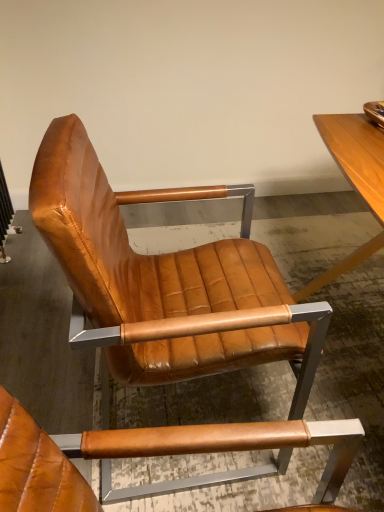
What do you see at coordinates (165, 281) in the screenshot? This screenshot has height=512, width=384. I see `cognac leather chair at center` at bounding box center [165, 281].

Find the location of a particular element. cognac leather chair at center is located at coordinates (165, 281).

Image resolution: width=384 pixels, height=512 pixels. I want to click on cognac leather chair at center, so click(165, 281).